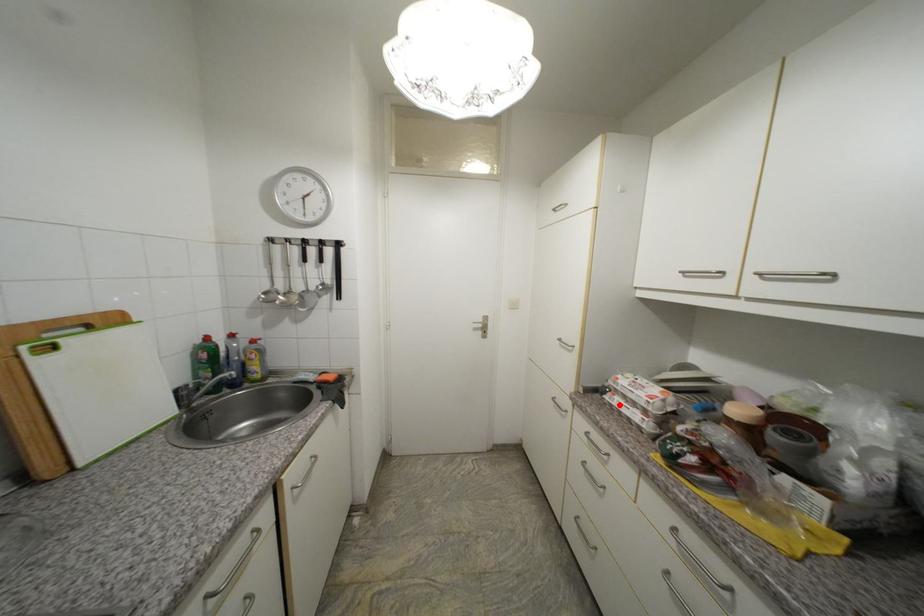
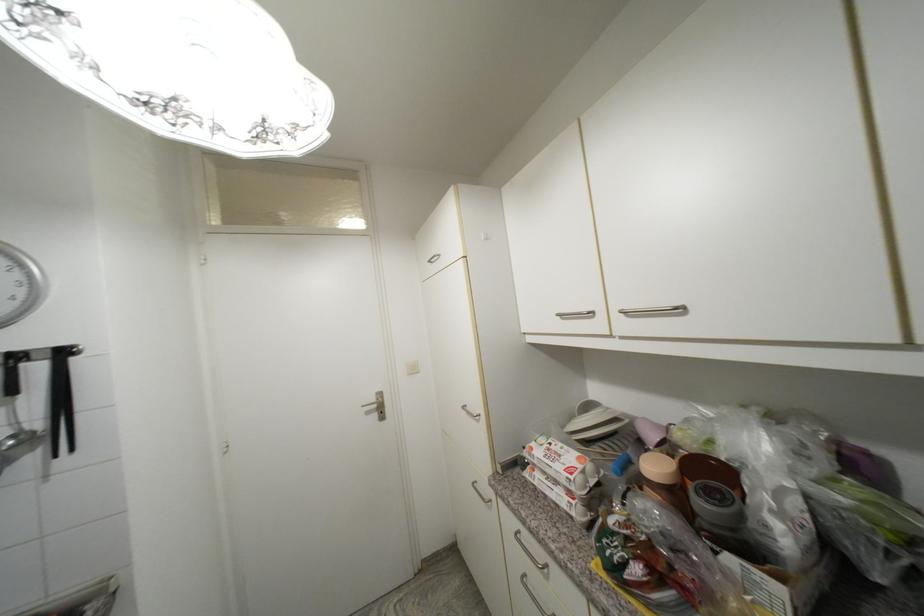
Where in the second image is the point corresponding to the highlighted location from the first image?

(541, 485)